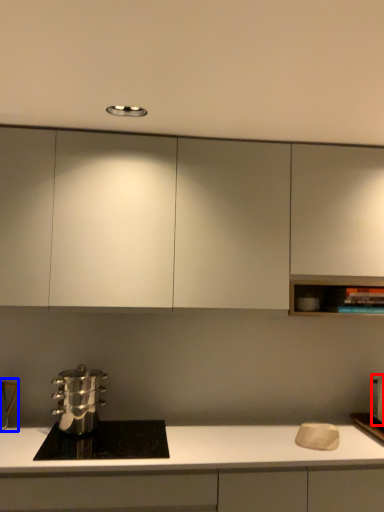
Question: Which point is further to the camera, appliance (highlighted by a red box) or appliance (highlighted by a blue box)?

Choices:
 (A) appliance
 (B) appliance

Answer: (A)